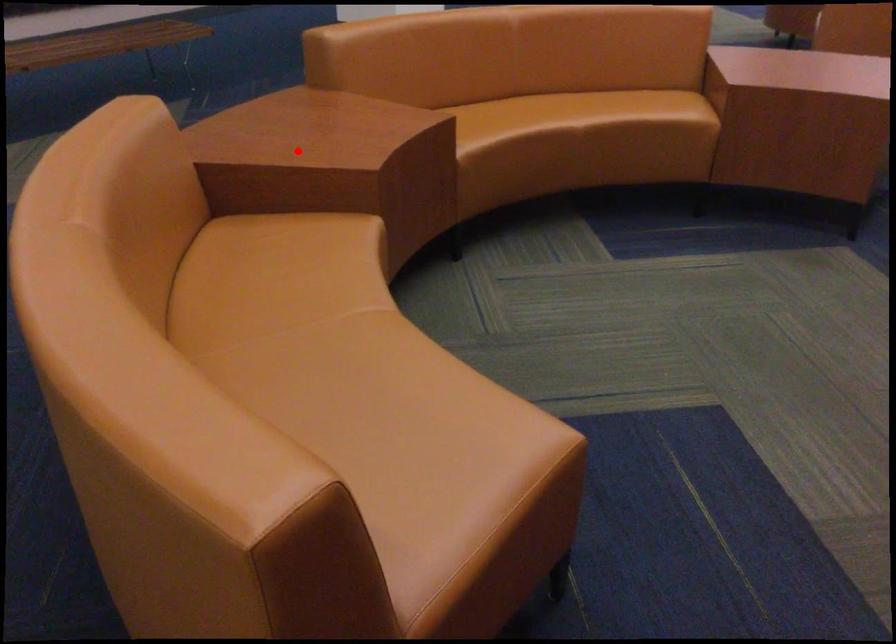
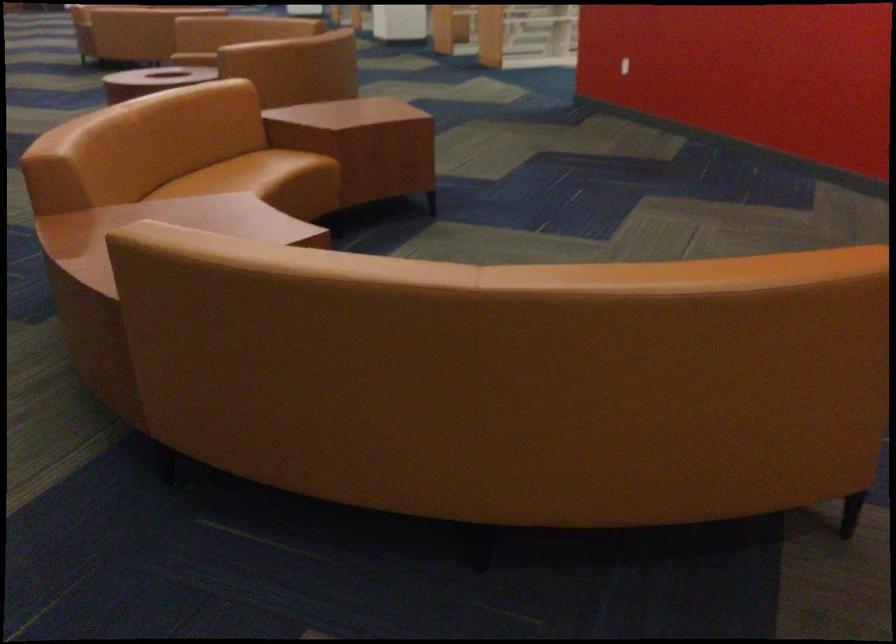
Question: I am providing you with two images of the same scene from different viewpoints. A red point is marked on the first image. At the location where the point appears in image 1, is it still visible in image 2?

Choices:
 (A) Yes
 (B) No

Answer: (B)